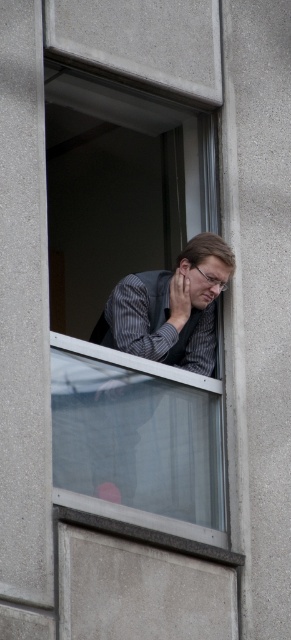
In the scene shown: Can you confirm if clear glass window at center is taller than matte gray vest at center?

Correct, clear glass window at center is much taller as matte gray vest at center.

Does clear glass window at center have a lesser height compared to matte gray vest at center?

No, clear glass window at center is not shorter than matte gray vest at center.

Which is behind, point (135, 157) or point (162, 310)?

Positioned behind is point (135, 157).

The image size is (291, 640). Identify the location of clear glass window at center. (130, 308).